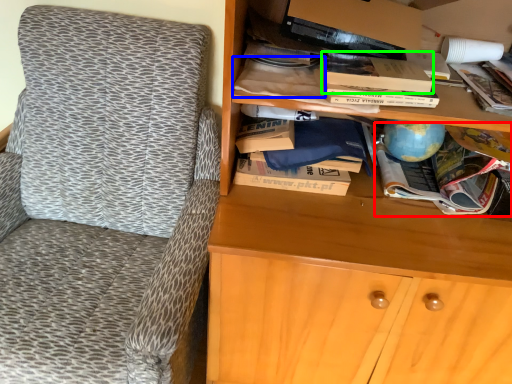
Question: Based on their relative distances, which object is farther from book (highlighted by a red box)? Choose from book (highlighted by a blue box) and paperback book (highlighted by a green box).

Choices:
 (A) book
 (B) paperback book

Answer: (A)